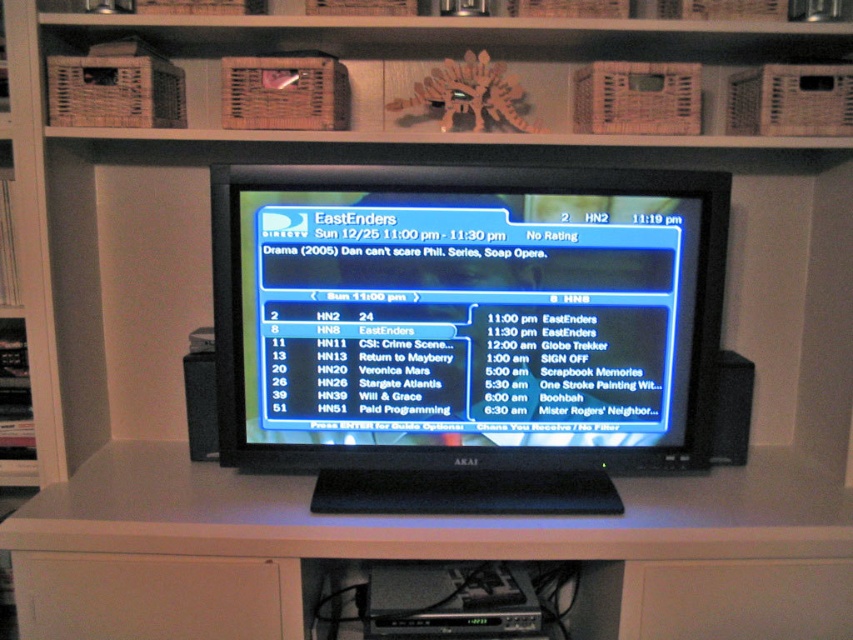
Is wooden at upper center above black plastic speaker at right?

Yes.

Is point (519, 72) positioned before point (721, 440)?

That is False.

Find the location of `wooden at upper center`. wooden at upper center is located at coordinates (457, 52).

Identify the location of black plastic speaker at right. Image resolution: width=853 pixels, height=640 pixels. (730, 410).

Based on the photo, can you confirm if black plastic speaker at right is positioned to the right of black plastic speaker at left?

Indeed, black plastic speaker at right is positioned on the right side of black plastic speaker at left.

What do you see at coordinates (730, 410) in the screenshot? This screenshot has width=853, height=640. I see `black plastic speaker at right` at bounding box center [730, 410].

Image resolution: width=853 pixels, height=640 pixels. What are the coordinates of `black plastic speaker at right` in the screenshot? It's located at (730, 410).

Between matte plastic tv screen at center and wooden at upper center, which one has less height?

With less height is wooden at upper center.

The image size is (853, 640). What do you see at coordinates (459, 317) in the screenshot?
I see `matte plastic tv screen at center` at bounding box center [459, 317].

You are a GUI agent. You are given a task and a screenshot of the screen. Output one action in this format:
    pyautogui.click(x=<x>, y=<y>)
    Task: Click on the matte plastic tv screen at center
    
    Given the screenshot: What is the action you would take?
    pyautogui.click(x=459, y=317)

You are a GUI agent. You are given a task and a screenshot of the screen. Output one action in this format:
    pyautogui.click(x=<x>, y=<y>)
    Task: Click on the matte plastic tv screen at center
    
    Given the screenshot: What is the action you would take?
    click(x=459, y=317)